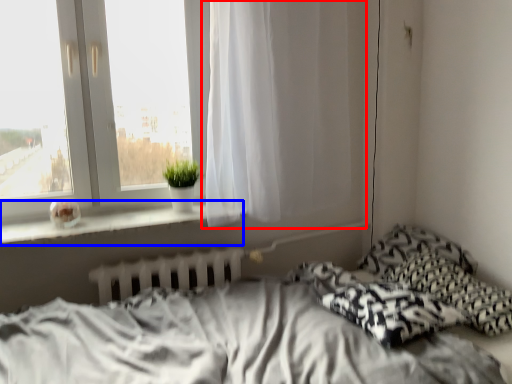
Question: Which of the following is the farthest to the observer, curtain (highlighted by a red box) or window sill (highlighted by a blue box)?

Choices:
 (A) curtain
 (B) window sill

Answer: (A)